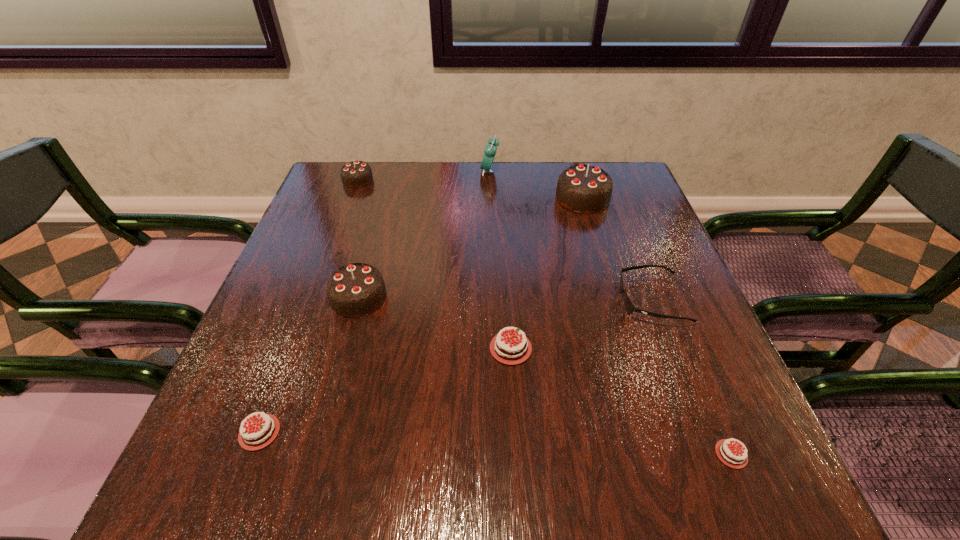
Where is `free space located on the right of the biggest red chocolate cake`? The image size is (960, 540). free space located on the right of the biggest red chocolate cake is located at coordinates (583, 348).

What are the coordinates of `free space located on the front-facing side of the black sunglasses` in the screenshot? It's located at (x=564, y=300).

This screenshot has width=960, height=540. In order to click on free space located on the front-facing side of the black sunglasses in this screenshot , I will do `click(577, 300)`.

You are a GUI agent. You are given a task and a screenshot of the screen. Output one action in this format:
    pyautogui.click(x=<x>, y=<y>)
    Task: Click on the free space located on the front-facing side of the black sunglasses
    The image size is (960, 540).
    Given the screenshot: What is the action you would take?
    pyautogui.click(x=484, y=300)

At what (x,y) coordinates should I click in order to perform the action: click on free region located on the back of the leftmost red chocolate cake. Please return your answer as a coordinate pair (x, y). The image size is (960, 540). Looking at the image, I should click on (306, 309).

Image resolution: width=960 pixels, height=540 pixels. I want to click on blank space located 0.120m on the back of the shortest object, so click(x=695, y=367).

Image resolution: width=960 pixels, height=540 pixels. What are the coordinates of `alarm clock present at the far edge` in the screenshot? It's located at (490, 150).

Where is `sunglasses at the right edge`? This screenshot has width=960, height=540. sunglasses at the right edge is located at coordinates (629, 306).

Where is `object that is at the far left corner`? object that is at the far left corner is located at coordinates (355, 174).

You are a GUI agent. You are given a task and a screenshot of the screen. Output one action in this format:
    pyautogui.click(x=<x>, y=<y>)
    Task: Click on the object situated at the near left corner
    The image size is (960, 540).
    Given the screenshot: What is the action you would take?
    pyautogui.click(x=259, y=434)